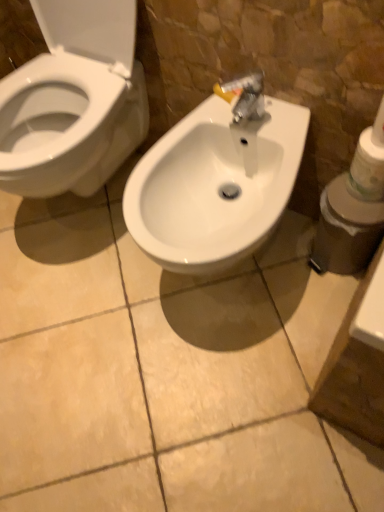
The width and height of the screenshot is (384, 512). I want to click on free space in front of white glossy sink at center, so click(x=236, y=393).